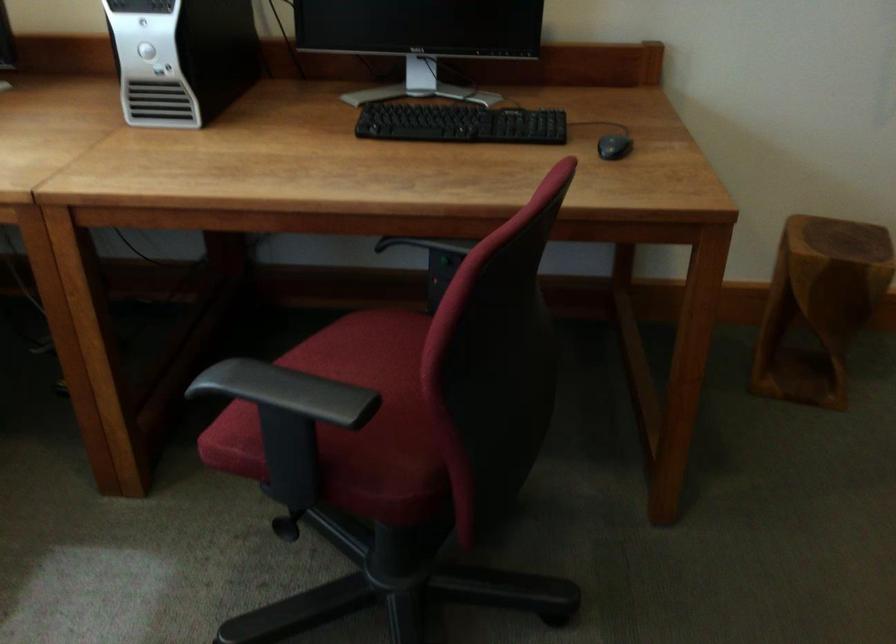
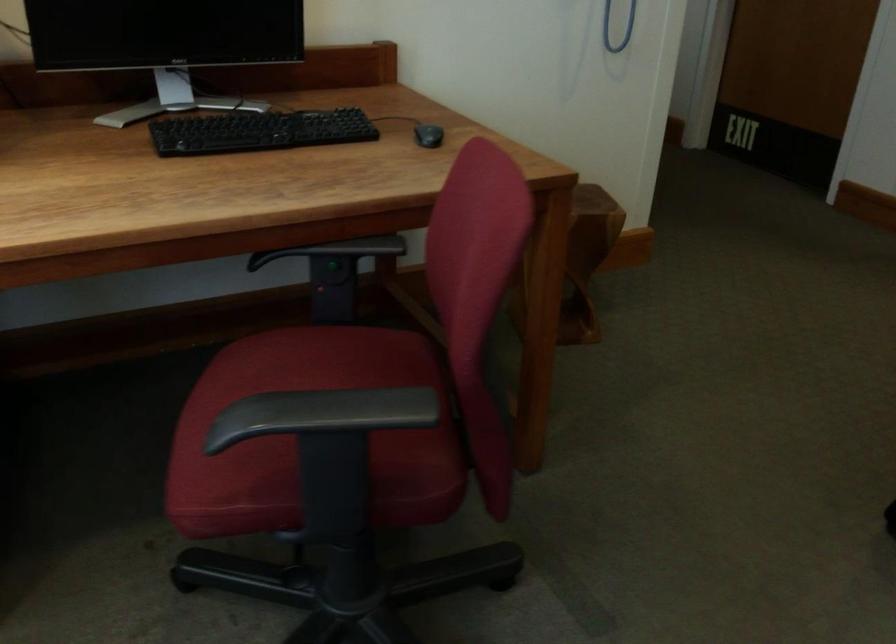
Find the pixel in the second image that matches the point at 607,146 in the first image.

(427, 135)